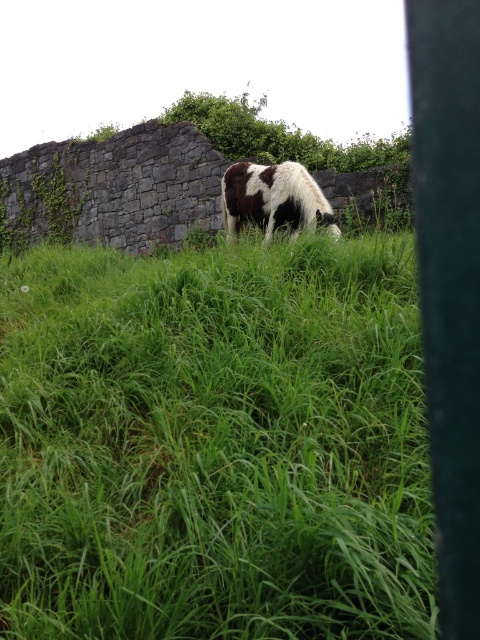
You are standing in the rural scene and want to take a photo of the spotted fur cow at center. Since the green grass at center is in front of you, will it block your view of the cow?

The green grass at center is closer to the viewer than the spotted fur cow at center, so yes, the green grass at center will block your view of the cow.

You are standing at the point with coordinates point (x=168, y=557) and want to walk to the point with coordinates point (x=263, y=214). Which direction should you move relative to the cow?

The cow is in the midground, so point (x=168, y=557) is in front of point (x=263, y=214). To reach point (x=263, y=214) from point (x=168, y=557), you should move behind the cow since point (x=263, y=214) is behind point (x=168, y=557) relative to the cow.